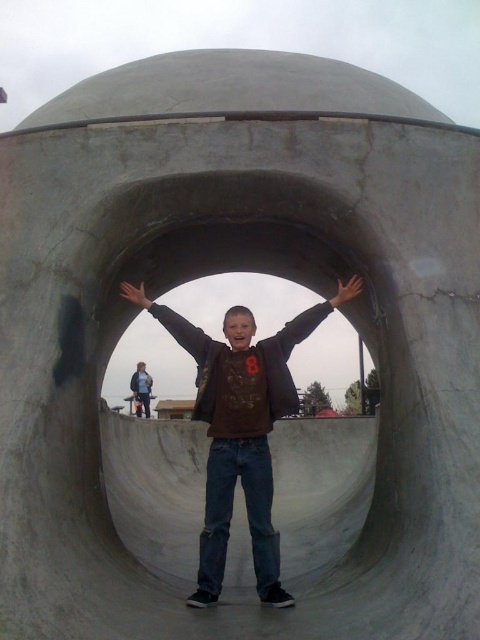
Measure the distance from black matte arm at center to light brown leather hand at center.

black matte arm at center is 6.86 feet away from light brown leather hand at center.

Does black matte arm at center have a lesser width compared to light brown leather hand at center?

Incorrect, black matte arm at center's width is not less than light brown leather hand at center's.

Where is `black matte arm at center`? This screenshot has height=640, width=480. black matte arm at center is located at coordinates (314, 316).

Where is `black matte arm at center`? Image resolution: width=480 pixels, height=640 pixels. black matte arm at center is located at coordinates click(x=314, y=316).

Does black matte arm at center appear on the right side of black matte hand at center?

Correct, you'll find black matte arm at center to the right of black matte hand at center.

Is point (359, 291) behind point (137, 301)?

No, it is not.

At what (x,y) coordinates should I click in order to perform the action: click on black matte arm at center. Please return your answer as a coordinate pair (x, y). Image resolution: width=480 pixels, height=640 pixels. Looking at the image, I should click on (314, 316).

Identify the location of black matte arm at center. (314, 316).

Does matte black arm at center appear on the left side of light brown leather hand at center?

Correct, you'll find matte black arm at center to the left of light brown leather hand at center.

Does matte black arm at center have a lesser width compared to light brown leather hand at center?

No, matte black arm at center is not thinner than light brown leather hand at center.

Which is behind, point (123, 284) or point (350, 276)?

Point (350, 276)

The width and height of the screenshot is (480, 640). In order to click on matte black arm at center in this screenshot , I will do `click(171, 323)`.